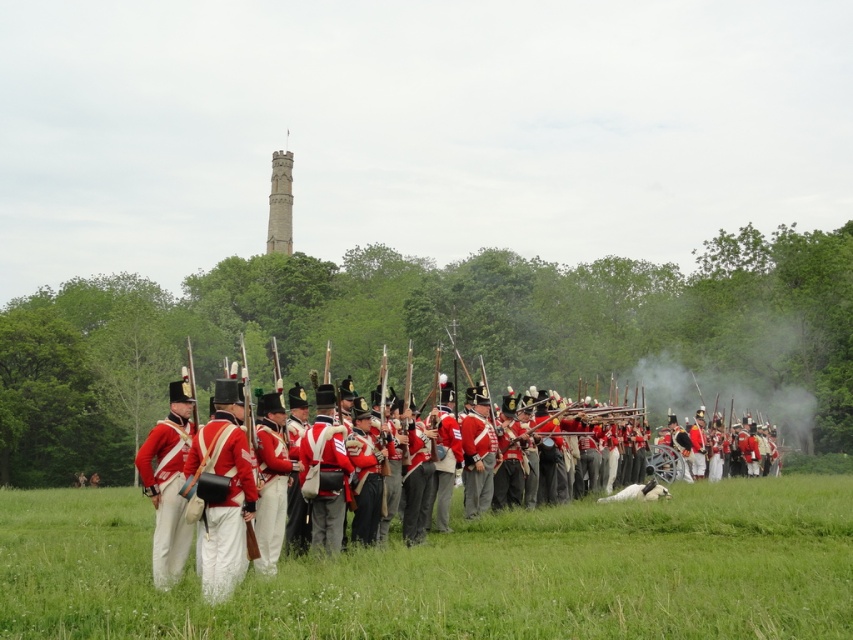
Looking at this image, you are a photographer positioned at the edge of the field. You want to capture a shot that includes both the group of soldiers in their British Redcoat uniforms and the green grass at center. Based on their positions, which object is closer to your current position?

The group of soldiers in their British Redcoat uniforms is closer to your current position because the green grass at center is located at point (461, 572), which is further away in the scene.

You are a photographer trying to capture a group photo of the soldiers in the historical reenactment. You need to ensure that both the red cotton uniform at center and the red wool uniform at left are visible in the frame. Based on their positions, which uniform is located to the left of the other?

The red cotton uniform at center is positioned on the right side of the red wool uniform at left, so the red wool uniform at left is to the left of the red cotton uniform at center.